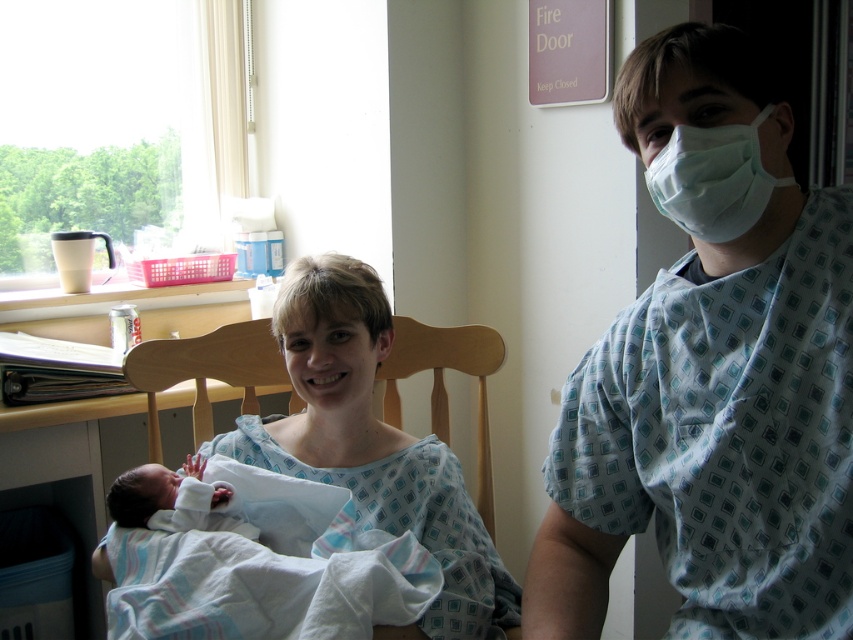
Question: Can you confirm if light blue printed scrubs at right is bigger than white medical mask at upper right?

Choices:
 (A) no
 (B) yes

Answer: (B)

Question: Estimate the real-world distances between objects in this image. Which object is farther from the white medical mask at upper right?

Choices:
 (A) wooden chair at center
 (B) light blue printed scrubs at right

Answer: (A)

Question: Which of the following is the farthest from the observer?

Choices:
 (A) white medical mask at upper right
 (B) light blue printed scrubs at right
 (C) wooden chair at center

Answer: (C)

Question: Which point is farther to the camera?

Choices:
 (A) light blue printed scrubs at right
 (B) white medical mask at upper right

Answer: (B)

Question: Does wooden chair at center have a greater width compared to white medical mask at upper right?

Choices:
 (A) yes
 (B) no

Answer: (A)

Question: Can you confirm if light blue printed scrubs at right is positioned to the left of wooden chair at center?

Choices:
 (A) no
 (B) yes

Answer: (A)